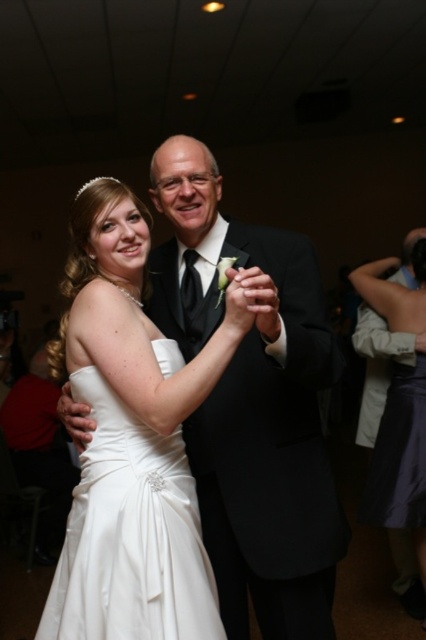
You are a photographer at a wedding reception. You need to position the white satin dress at center and the satin purple dress at lower right in a group photo. Which dress should you place closer to the camera to ensure both appear proportionally sized in the photo?

The white satin dress at center is smaller than the satin purple dress at lower right. To make them appear proportionally sized in the photo, you should place the satin purple dress at lower right closer to the camera since it is larger and needs to be smaller in the frame to match the size of the white satin dress at center.

You are a photographer at a wedding reception and need to capture a photo of both the white satin dress at center and the satin purple dress at lower right. Based on their positions, which dress should you focus on first to ensure both are in the frame?

The white satin dress at center is in front of the satin purple dress at lower right, so you should focus on the white satin dress at center first to ensure both are in the frame.